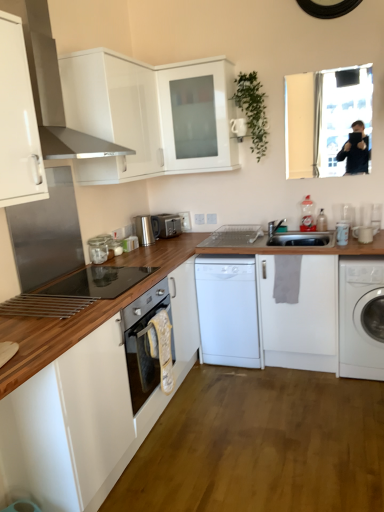
Locate an element on the screen. The image size is (384, 512). vacant area located to the right-hand side of satin silver toaster at center, which ranks as the 4th appliance in right-to-left order is located at coordinates (191, 237).